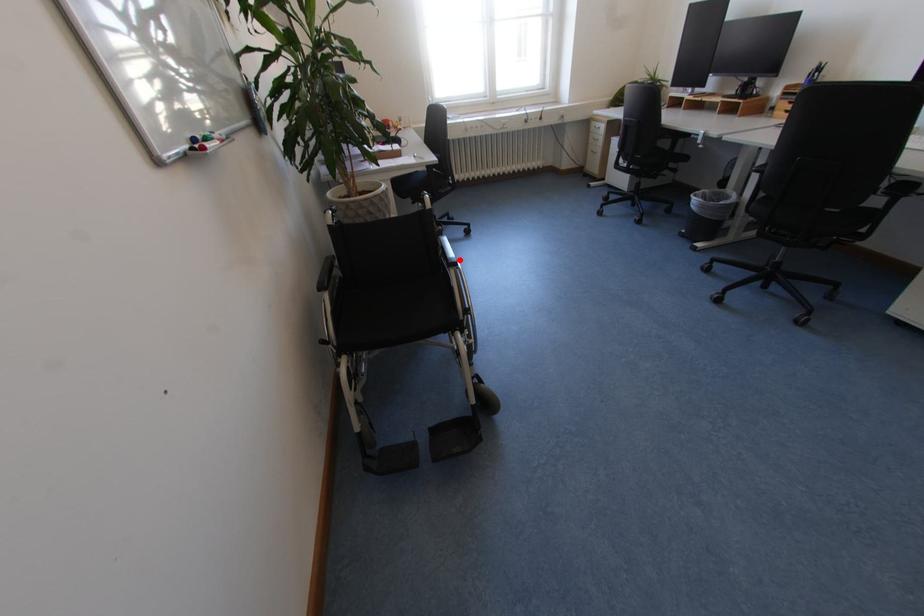
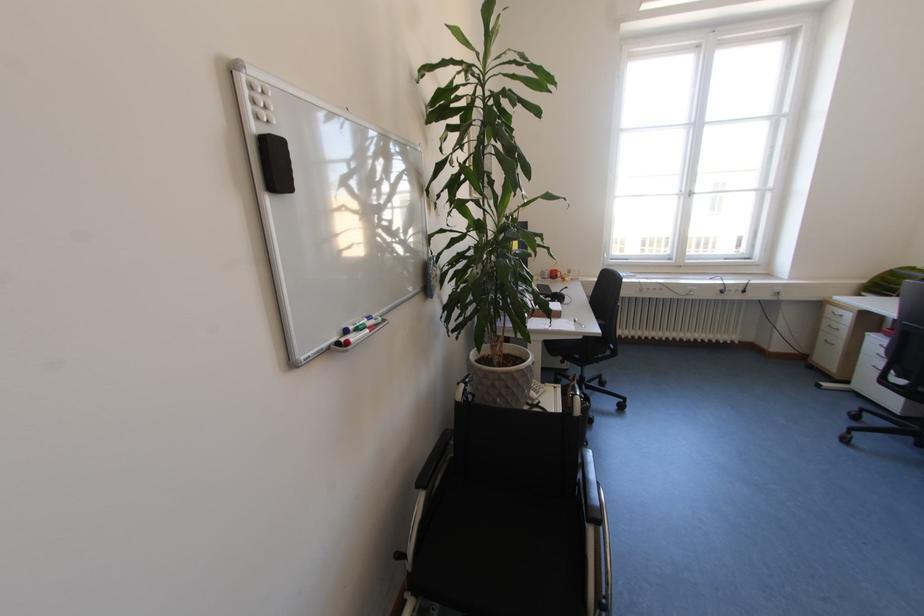
Where in the second image is the point corresponding to the highlighted location from the first image?

(602, 508)